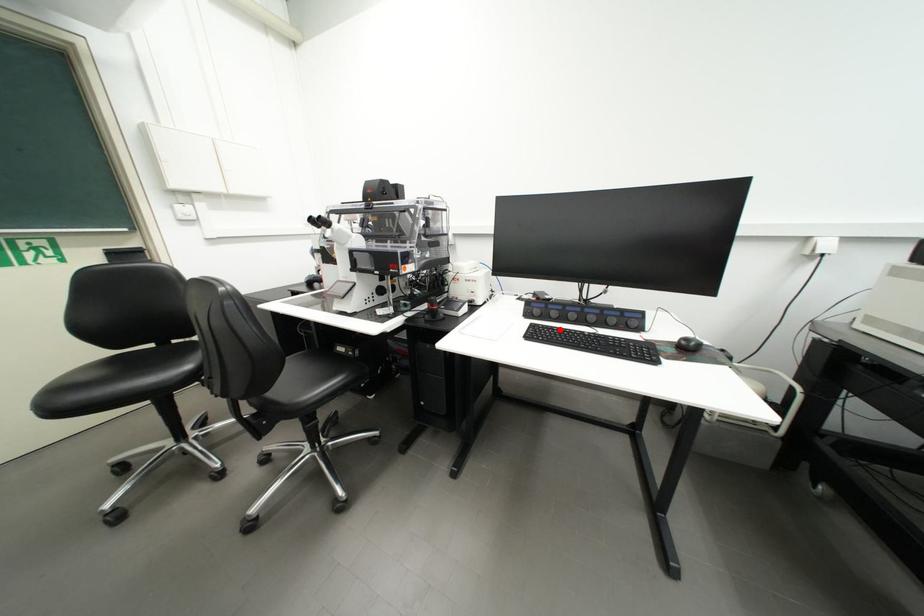
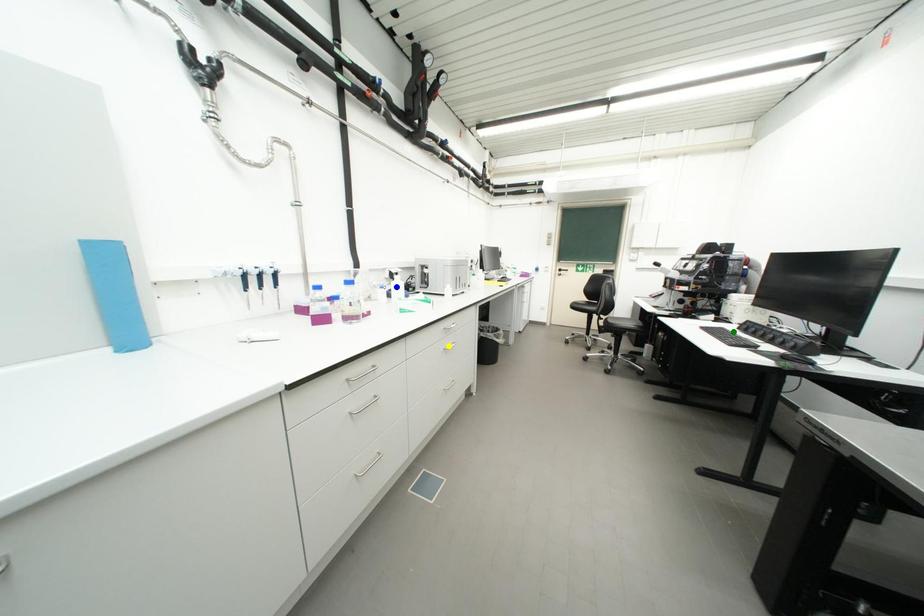
Question: I am providing you with two images of the same scene from different viewpoints. A red point is marked on the first image. You are given multiple points on the second image. In image 2, which mark is for the same physical point as the one in image 1?

Choices:
 (A) blue point
 (B) green point
 (C) yellow point

Answer: (B)